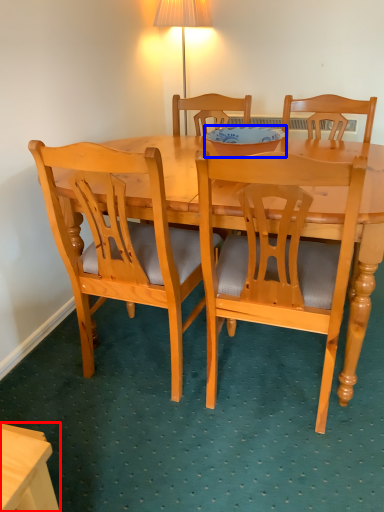
Question: Among these objects, which one is farthest to the camera, desk (highlighted by a red box) or bowl (highlighted by a blue box)?

Choices:
 (A) desk
 (B) bowl

Answer: (B)